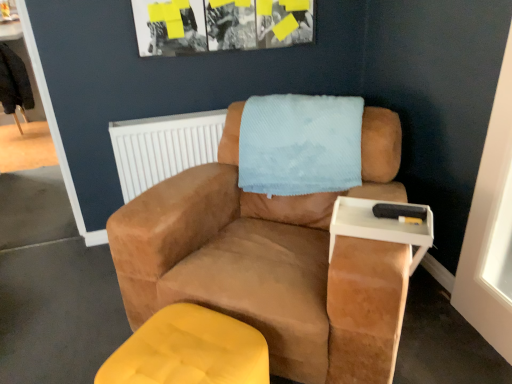
Measure the distance between suede brown armchair at center and camera.

The distance of suede brown armchair at center from camera is 1.21 meters.

At what (x,y) coordinates should I click in order to perform the action: click on white plastic radiator at upper center. Please return your answer as a coordinate pair (x, y). Looking at the image, I should click on (163, 147).

Identify the location of matte yellow ottoman at lower left. This screenshot has width=512, height=384. (189, 351).

Find the location of `suede brown armchair at center`. suede brown armchair at center is located at coordinates (273, 261).

Is white plastic radiator at upper center looking in the opposite direction of matte yellow ottoman at lower left?

No.

Locate an element on the screen. radiator that appears above the matte yellow ottoman at lower left (from the image's perspective) is located at coordinates (163, 147).

Can you confirm if white plastic radiator at upper center is smaller than matte yellow ottoman at lower left?

Yes.

Considering the relative sizes of white plastic radiator at upper center and matte yellow ottoman at lower left in the image provided, is white plastic radiator at upper center wider than matte yellow ottoman at lower left?

In fact, white plastic radiator at upper center might be narrower than matte yellow ottoman at lower left.

This screenshot has height=384, width=512. Identify the location of radiator behind the matte yellow ottoman at lower left. (163, 147).

Looking at this image, from a real-world perspective, which object rests below the other?

In real-world perspective, matte yellow ottoman at lower left is lower.

Who is bigger, matte yellow ottoman at lower left or white plastic radiator at upper center?

With larger size is matte yellow ottoman at lower left.

Is matte yellow ottoman at lower left outside of white plastic radiator at upper center?

Yes.

Is white plastic tray at right at the left side of matte yellow ottoman at lower left?

No.

Considering the sizes of objects white plastic tray at right and matte yellow ottoman at lower left in the image provided, who is thinner, white plastic tray at right or matte yellow ottoman at lower left?

white plastic tray at right.

Which is in front, point (374, 235) or point (167, 330)?

Point (167, 330)

Consider the image. Who is taller, white plastic tray at right or matte yellow ottoman at lower left?

matte yellow ottoman at lower left is taller.

From the image's perspective, is suede brown armchair at center located above or below white plastic tray at right?

Based on their image positions, suede brown armchair at center is located above white plastic tray at right.

Can you confirm if suede brown armchair at center is shorter than white plastic tray at right?

No.

Can you tell me how much suede brown armchair at center and white plastic tray at right differ in facing direction?

They differ by 3.54 degrees in their facing directions.

Which is more to the right, suede brown armchair at center or white plastic tray at right?

From the viewer's perspective, white plastic tray at right appears more on the right side.

Which object is positioned more to the right, suede brown armchair at center or matte yellow ottoman at lower left?

Positioned to the right is suede brown armchair at center.

Which object is thinner, suede brown armchair at center or matte yellow ottoman at lower left?

With smaller width is matte yellow ottoman at lower left.

Which is less distant, [234,299] or [173,306]?

Point [234,299] is positioned closer to the camera compared to point [173,306].

Based on their sizes in the image, would you say white plastic radiator at upper center is bigger or smaller than white plastic tray at right?

In the image, white plastic radiator at upper center appears to be larger than white plastic tray at right.

Considering the relative sizes of white plastic radiator at upper center and white plastic tray at right in the image provided, is white plastic radiator at upper center thinner than white plastic tray at right?

Yes.

Looking at this image, which point is more distant from viewer, (111, 127) or (424, 224)?

The point (111, 127) is more distant.

Is white plastic radiator at upper center spatially inside white plastic tray at right, or outside of it?

white plastic radiator at upper center is located beyond the bounds of white plastic tray at right.

Does point (208, 318) come closer to viewer compared to point (384, 228)?

No, (208, 318) is behind (384, 228).

Which object is further away from the camera, matte yellow ottoman at lower left or white plastic tray at right?

white plastic tray at right is more distant.

From a real-world perspective, is matte yellow ottoman at lower left located higher than white plastic tray at right?

No, from a real-world perspective, matte yellow ottoman at lower left is not over white plastic tray at right

In the scene shown: Can you confirm if matte yellow ottoman at lower left is shorter than white plastic tray at right?

Incorrect, the height of matte yellow ottoman at lower left does not fall short of that of white plastic tray at right.

Locate an element on the screen. Image resolution: width=512 pixels, height=384 pixels. radiator behind the matte yellow ottoman at lower left is located at coordinates (163, 147).

In the image, there is a white plastic radiator at upper center. At what (x,y) coordinates should I click in order to perform the action: click on furniture below it (from a real-world perspective). Please return your answer as a coordinate pair (x, y). Looking at the image, I should click on (189, 351).

Considering their positions, is matte yellow ottoman at lower left positioned further to white plastic radiator at upper center than suede brown armchair at center?

The object further to white plastic radiator at upper center is matte yellow ottoman at lower left.

Which object lies further to the anchor point matte yellow ottoman at lower left, white plastic tray at right or white plastic radiator at upper center?

white plastic radiator at upper center is positioned further to the anchor matte yellow ottoman at lower left.

Which object lies further to the anchor point white plastic radiator at upper center, white plastic tray at right or suede brown armchair at center?

white plastic tray at right is positioned further to the anchor white plastic radiator at upper center.

Estimate the real-world distances between objects in this image. Which object is further from white plastic tray at right, suede brown armchair at center or matte yellow ottoman at lower left?

Among the two, matte yellow ottoman at lower left is located further to white plastic tray at right.

From the image, which object appears to be farther from matte yellow ottoman at lower left, white plastic tray at right or suede brown armchair at center?

white plastic tray at right is positioned further to the anchor matte yellow ottoman at lower left.

Considering their positions, is matte yellow ottoman at lower left positioned further to white plastic tray at right than suede brown armchair at center?

Based on the image, matte yellow ottoman at lower left appears to be further to white plastic tray at right.

Looking at the image, which one is located further to white plastic radiator at upper center, white plastic tray at right or matte yellow ottoman at lower left?

matte yellow ottoman at lower left is further to white plastic radiator at upper center.

In the scene shown: Based on their spatial positions, is matte yellow ottoman at lower left or white plastic tray at right closer to white plastic radiator at upper center?

Among the two, white plastic tray at right is located nearer to white plastic radiator at upper center.

What are the coordinates of `chair positioned between matte yellow ottoman at lower left and white plastic radiator at upper center from near to far` in the screenshot? It's located at (273, 261).

Locate an element on the screen. The image size is (512, 384). table between suede brown armchair at center and white plastic radiator at upper center along the z-axis is located at coordinates (383, 224).

Find the location of a particular element. Image resolution: width=512 pixels, height=384 pixels. table between matte yellow ottoman at lower left and white plastic radiator at upper center in the front-back direction is located at coordinates (383, 224).

The height and width of the screenshot is (384, 512). Identify the location of table between suede brown armchair at center and matte yellow ottoman at lower left in the up-down direction. (383, 224).